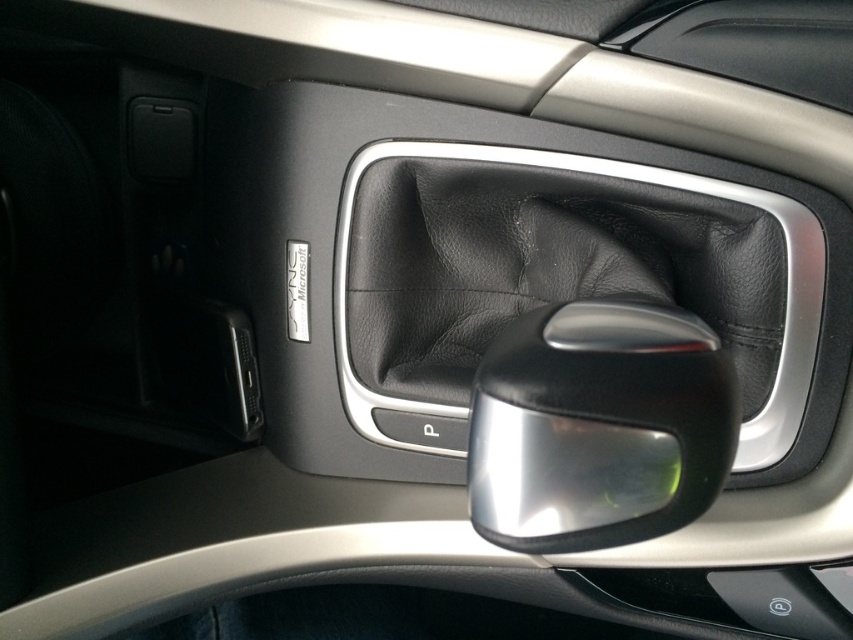
Question: Which object is farther from the camera taking this photo?

Choices:
 (A) satin black door handle at center
 (B) black leather at center

Answer: (B)

Question: Is black leather at center closer to camera compared to satin black door handle at center?

Choices:
 (A) no
 (B) yes

Answer: (A)

Question: Can you confirm if black leather at center is wider than satin black door handle at center?

Choices:
 (A) no
 (B) yes

Answer: (B)

Question: Which object is closer to the camera taking this photo?

Choices:
 (A) satin black door handle at center
 (B) black leather at center

Answer: (A)

Question: Which point appears farthest from the camera in this image?

Choices:
 (A) (772, 310)
 (B) (643, 410)

Answer: (A)

Question: Is black leather at center thinner than satin black door handle at center?

Choices:
 (A) no
 (B) yes

Answer: (A)